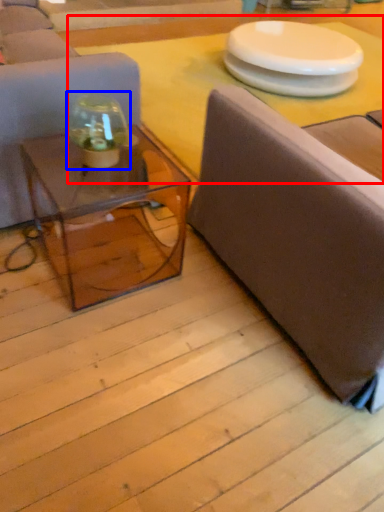
Question: Which object is closer to the camera taking this photo, table top (highlighted by a red box) or glass vase (highlighted by a blue box)?

Choices:
 (A) table top
 (B) glass vase

Answer: (B)